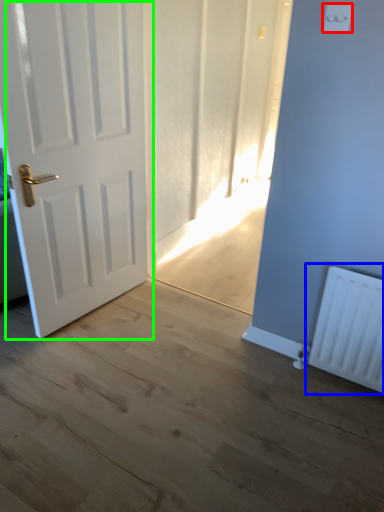
Question: Which object is the farthest from light switch (highlighted by a red box)? Choose among these: radiator (highlighted by a blue box) or door (highlighted by a green box).

Choices:
 (A) radiator
 (B) door

Answer: (B)